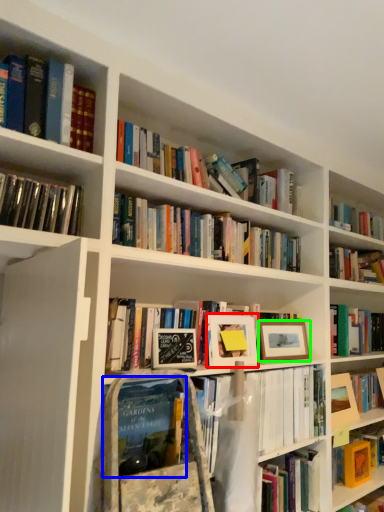
Question: Which is nearer to the picture frame (highlighted by a red box)? book (highlighted by a blue box) or picture frame (highlighted by a green box).

Choices:
 (A) book
 (B) picture frame

Answer: (B)